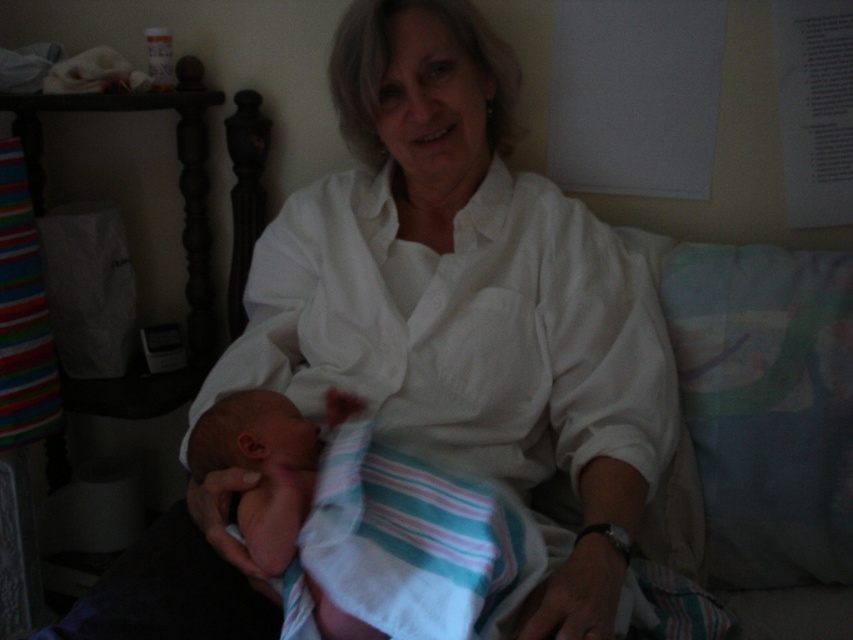
Question: Which of the following is the closest to the observer?

Choices:
 (A) soft white swaddle at center
 (B) white cotton shirt at center

Answer: (A)

Question: Does white cotton shirt at center have a lesser width compared to soft white swaddle at center?

Choices:
 (A) no
 (B) yes

Answer: (A)

Question: Which point is closer to the camera?

Choices:
 (A) soft white swaddle at center
 (B) white cotton shirt at center

Answer: (A)

Question: Which point is closer to the camera taking this photo?

Choices:
 (A) (276, 493)
 (B) (302, 269)

Answer: (A)

Question: Is white cotton shirt at center to the right of soft white swaddle at center from the viewer's perspective?

Choices:
 (A) yes
 (B) no

Answer: (A)

Question: Is the position of white cotton shirt at center less distant than that of soft white swaddle at center?

Choices:
 (A) no
 (B) yes

Answer: (A)